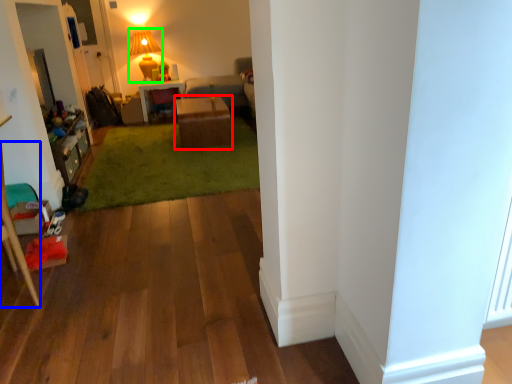
Question: Which is farther away from table (highlighted by a red box)? furniture (highlighted by a blue box) or lamp (highlighted by a green box)?

Choices:
 (A) furniture
 (B) lamp

Answer: (A)